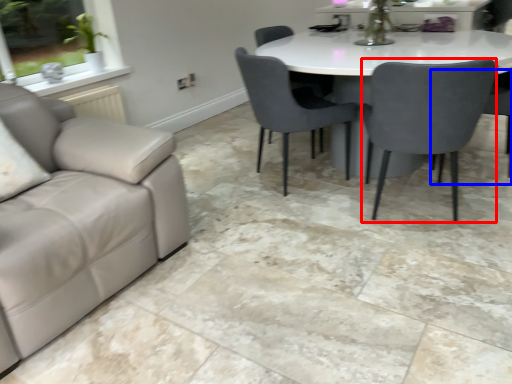
Question: Which point is closer to the camera, chair (highlighted by a red box) or chair (highlighted by a blue box)?

Choices:
 (A) chair
 (B) chair

Answer: (A)